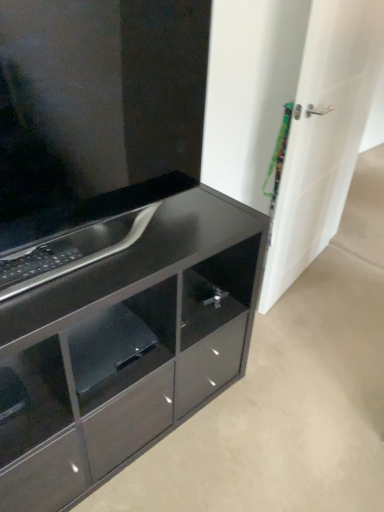
At what (x,y) coordinates should I click in order to perform the action: click on empty space that is to the right of glossy black cabinet at lower left. Please return your answer as a coordinate pair (x, y). Looking at the image, I should click on click(272, 416).